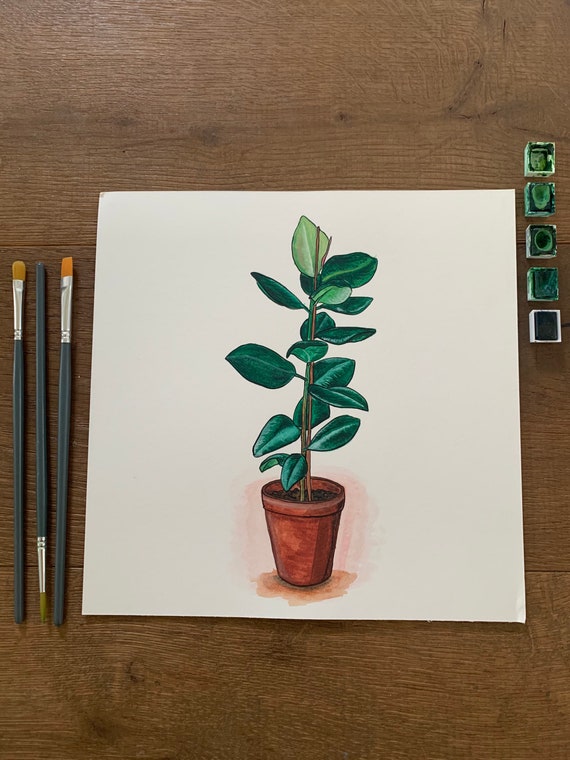
The image size is (570, 760). In order to click on dark green paint in this screenshot , I will do 543,334.